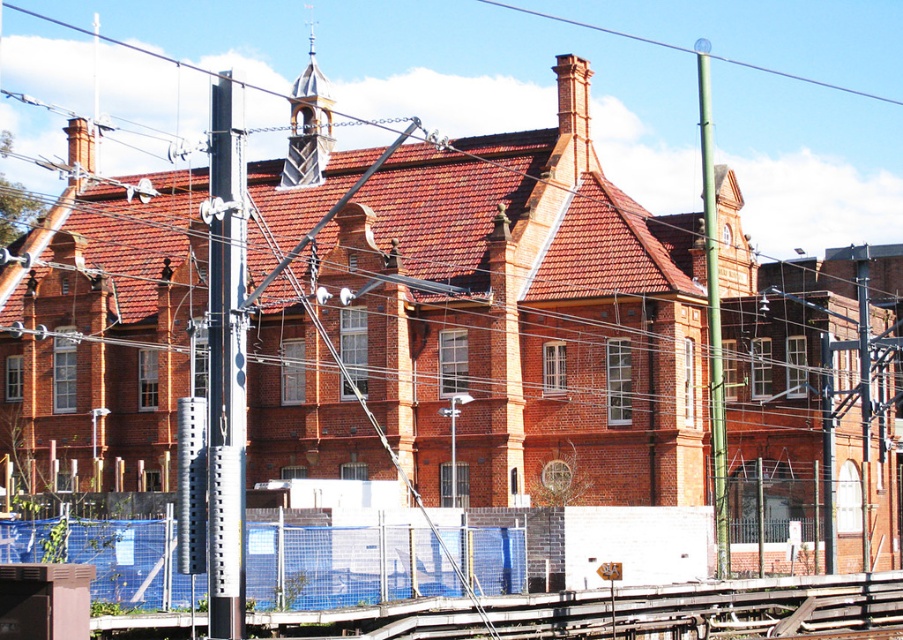
Can you confirm if green metallic pole at right is shorter than metallic wire at upper center?

Incorrect, green metallic pole at right's height does not fall short of metallic wire at upper center's.

Is green metallic pole at right smaller than metallic wire at upper center?

No.

Who is more forward, (720, 477) or (689, 52)?

Positioned in front is point (720, 477).

This screenshot has width=903, height=640. In order to click on green metallic pole at right in this screenshot , I will do `click(713, 317)`.

Can you confirm if metallic gray pole at left is wider than green metallic pole at right?

In fact, metallic gray pole at left might be narrower than green metallic pole at right.

Can you confirm if metallic gray pole at left is taller than green metallic pole at right?

No, metallic gray pole at left is not taller than green metallic pole at right.

Does point (225, 525) lie in front of point (706, 259)?

Yes, it is.

Where is `metallic gray pole at left`? The image size is (903, 640). metallic gray pole at left is located at coordinates (226, 362).

Which of these two, metallic gray pole at left or metallic wire at upper center, stands shorter?

metallic wire at upper center

Is point (222, 506) in front of point (859, 92)?

Yes, it is.

Find the location of `metallic gray pole at left`. metallic gray pole at left is located at coordinates (226, 362).